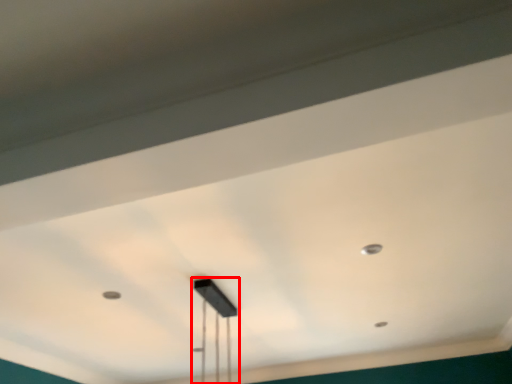
Question: In this image, where is lamp (annotated by the red box) located relative to dot?

Choices:
 (A) left
 (B) right

Answer: (A)